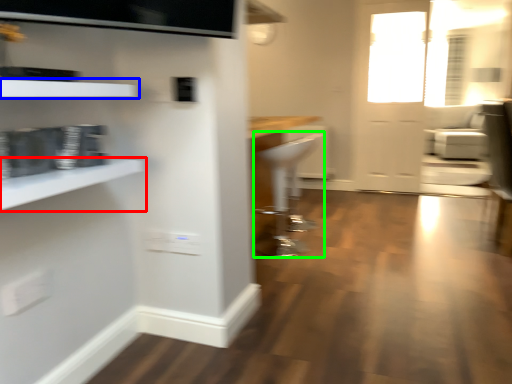
Question: Which is nearer to the shelf (highlighted by a red box)? shelf (highlighted by a blue box) or armchair (highlighted by a green box).

Choices:
 (A) shelf
 (B) armchair

Answer: (A)